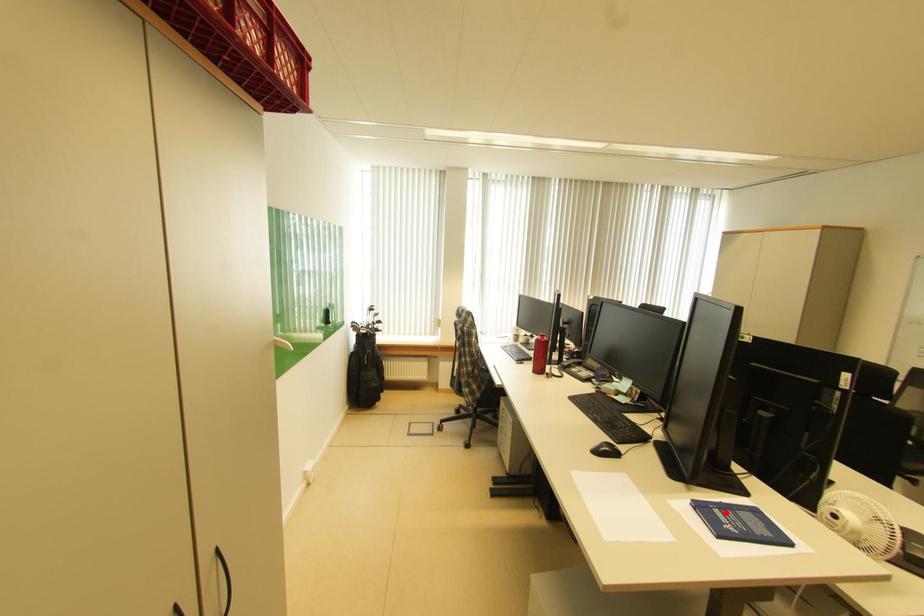
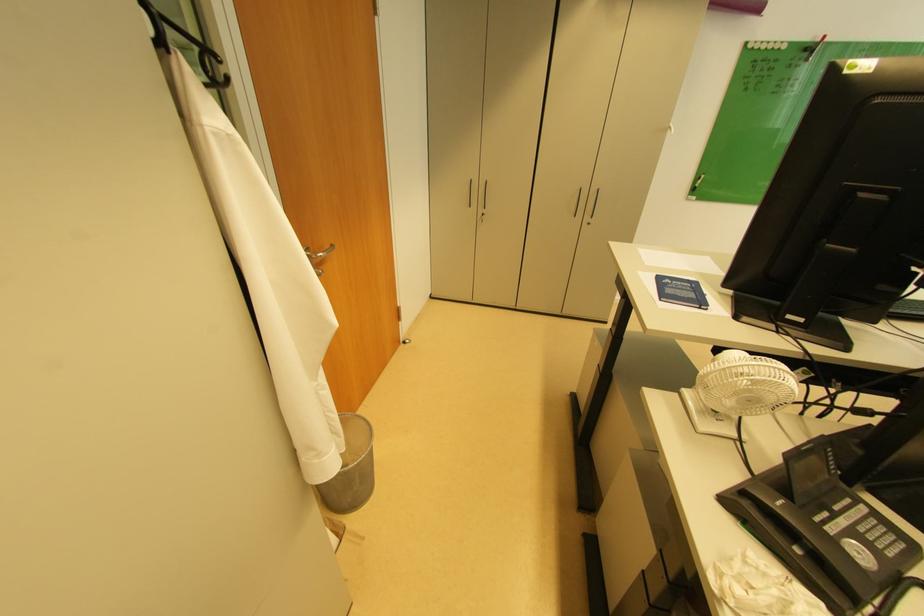
Find the pixel in the second image that matches the highlighted location in the first image.

(697, 286)